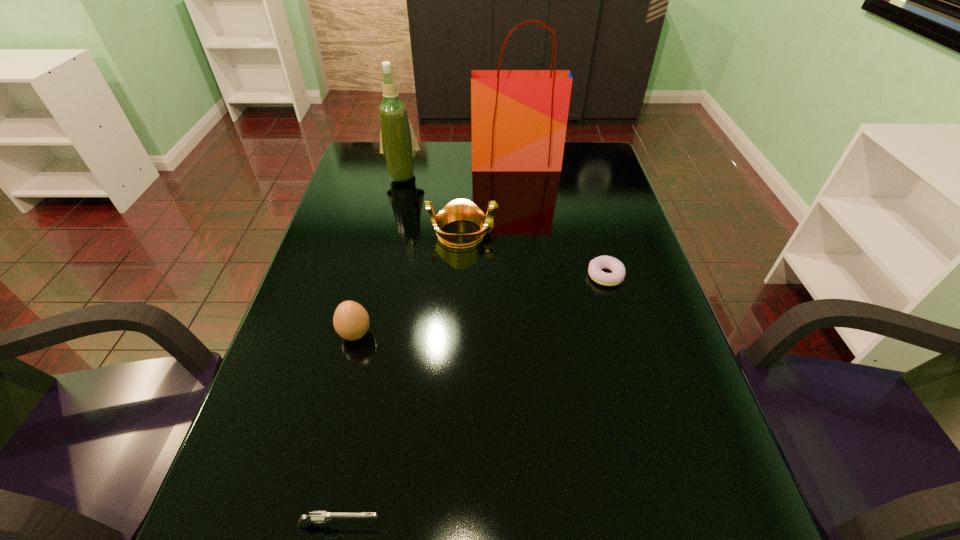
This screenshot has height=540, width=960. Identify the location of free area in between the tiara and the tallest object. (489, 198).

At what (x,y) coordinates should I click in order to perform the action: click on vacant space that is in between the boiled egg and the rightmost object. Please return your answer as a coordinate pair (x, y). Looking at the image, I should click on (481, 305).

Where is `vacant space in between the fifth shortest object and the shopping bag`? The width and height of the screenshot is (960, 540). vacant space in between the fifth shortest object and the shopping bag is located at coordinates (459, 169).

The width and height of the screenshot is (960, 540). Identify the location of unoccupied area between the wine bottle and the tiara. (x=432, y=205).

Locate an element on the screen. This screenshot has height=540, width=960. vacant space in between the wine bottle and the boiled egg is located at coordinates (379, 255).

Locate an element on the screen. Image resolution: width=960 pixels, height=540 pixels. vacant area between the fourth nearest object and the rightmost object is located at coordinates (534, 254).

Select which object appears as the fourth closest to the second nearest object. Please provide its 2D coordinates. Your answer should be formatted as a tuple, i.e. [(x, y)], where the tuple contains the x and y coordinates of a point satisfying the conditions above.

[(398, 143)]

The height and width of the screenshot is (540, 960). Find the location of `object that is the second nearest to the pistol`. object that is the second nearest to the pistol is located at coordinates (460, 209).

The image size is (960, 540). Identify the location of vacant region that satisfies the following two spatial constraints: 1. on the handle side of the shopping bag; 2. on the front-facing side of the nearest object. (555, 525).

The height and width of the screenshot is (540, 960). I want to click on free space in the image that satisfies the following two spatial constraints: 1. at the front emblem of the fourth nearest object; 2. on the left side of the rightmost object, so click(461, 275).